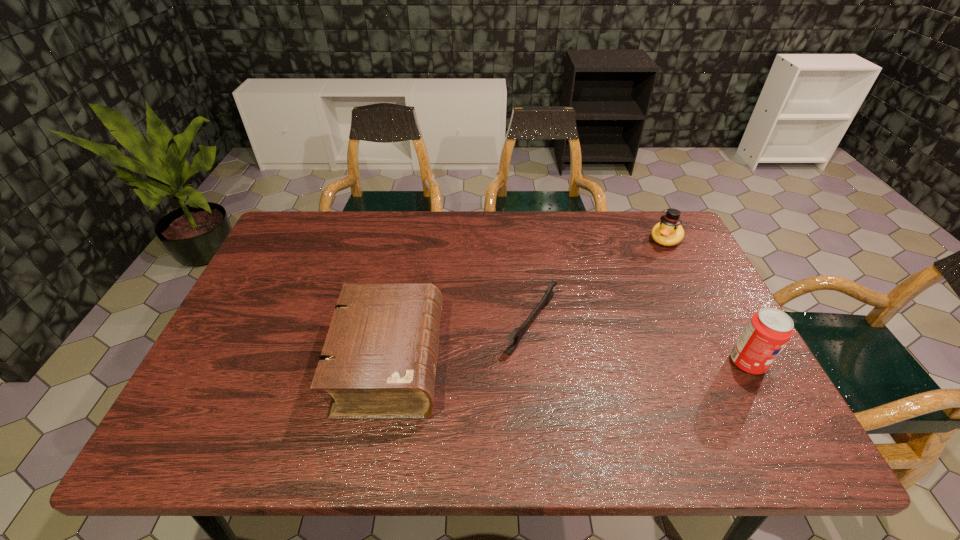
In the image, there is a desktop. Where is `vacant space at the right edge`? This screenshot has width=960, height=540. vacant space at the right edge is located at coordinates (688, 265).

Image resolution: width=960 pixels, height=540 pixels. Find the location of `unoccupied position between the second object from left to right and the farthest object`. unoccupied position between the second object from left to right and the farthest object is located at coordinates (599, 281).

This screenshot has height=540, width=960. I want to click on free space between the leftmost object and the shortest object, so click(x=461, y=343).

This screenshot has height=540, width=960. I want to click on vacant space in between the soda can and the wrench, so [639, 343].

Identify the location of vacant point located between the second object from left to right and the soda can. (639, 343).

Where is `vacant space that's between the leftmost object and the farthest object`? This screenshot has height=540, width=960. vacant space that's between the leftmost object and the farthest object is located at coordinates (528, 301).

Where is `vacant region between the soda can and the second object from left to right`? vacant region between the soda can and the second object from left to right is located at coordinates (639, 343).

The width and height of the screenshot is (960, 540). In order to click on free area in between the farthest object and the tallest object in this screenshot , I will do `click(707, 301)`.

Where is `free point between the tallest object and the shortest object`? free point between the tallest object and the shortest object is located at coordinates (639, 343).

You are a GUI agent. You are given a task and a screenshot of the screen. Output one action in this format:
    pyautogui.click(x=<x>, y=<y>)
    Task: Click on the free spot between the tallest object and the duck
    This screenshot has height=540, width=960.
    Given the screenshot: What is the action you would take?
    click(707, 301)